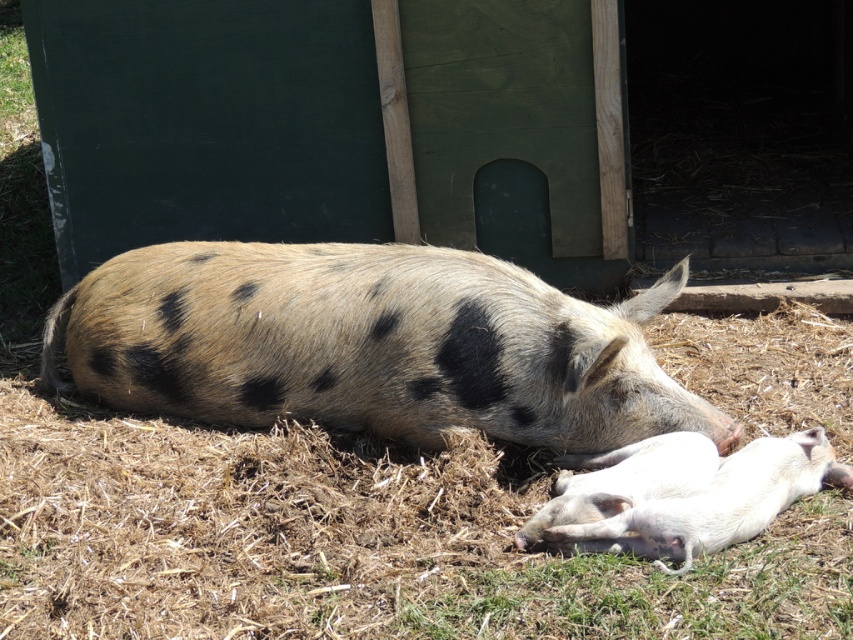
Between white smooth piglet at lower right and white smooth piglet at lower center, which one has more height?

Standing taller between the two is white smooth piglet at lower right.

How distant is white smooth piglet at lower right from white smooth piglet at lower center?

white smooth piglet at lower right is 3.48 inches from white smooth piglet at lower center.

Find the location of a particular element. The width and height of the screenshot is (853, 640). white smooth piglet at lower right is located at coordinates (712, 500).

Is point (96, 275) positioned in front of point (590, 536)?

That is False.

Does spotted fur pig at center appear under white smooth piglet at lower right?

Incorrect, spotted fur pig at center is not positioned below white smooth piglet at lower right.

The height and width of the screenshot is (640, 853). Describe the element at coordinates (370, 344) in the screenshot. I see `spotted fur pig at center` at that location.

You are a GUI agent. You are given a task and a screenshot of the screen. Output one action in this format:
    pyautogui.click(x=<x>, y=<y>)
    Task: Click on the spotted fur pig at center
    The image size is (853, 640).
    Given the screenshot: What is the action you would take?
    pyautogui.click(x=370, y=344)

Between spotted fur pig at center and white smooth piglet at lower center, which one has less height?

Standing shorter between the two is white smooth piglet at lower center.

Which is more to the left, spotted fur pig at center or white smooth piglet at lower center?

Positioned to the left is spotted fur pig at center.

Locate an element on the screen. This screenshot has width=853, height=640. spotted fur pig at center is located at coordinates (370, 344).

Find the location of a particular element. Image resolution: width=853 pixels, height=640 pixels. spotted fur pig at center is located at coordinates (370, 344).